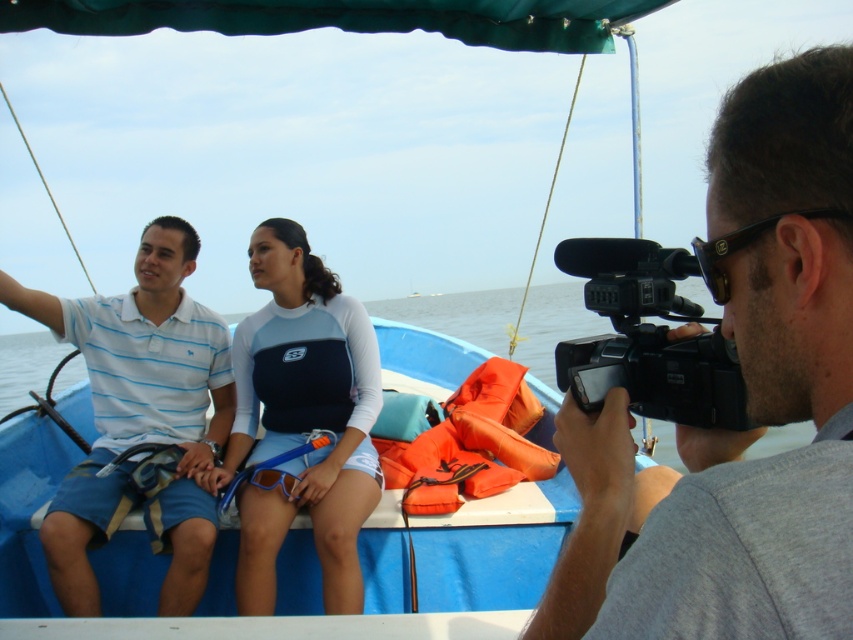
Question: Can you confirm if gray matte camera at right is bigger than light blue striped polo shirt at left?

Choices:
 (A) yes
 (B) no

Answer: (B)

Question: Can you confirm if blue neoprene wetsuit at center is positioned to the right of orange fabric life jacket at center?

Choices:
 (A) yes
 (B) no

Answer: (B)

Question: Which point appears farthest from the camera in this image?

Choices:
 (A) (757, 225)
 (B) (422, 449)

Answer: (B)

Question: Considering the real-world distances, which object is closest to the orange fabric life jacket at center?

Choices:
 (A) black plastic ear at center
 (B) black plastic video camera at right

Answer: (B)

Question: Is gray matte camera at right further to the viewer compared to black plastic video camera at right?

Choices:
 (A) no
 (B) yes

Answer: (A)

Question: Which of the following is the farthest from the observer?

Choices:
 (A) (648, 312)
 (B) (491, 400)

Answer: (B)